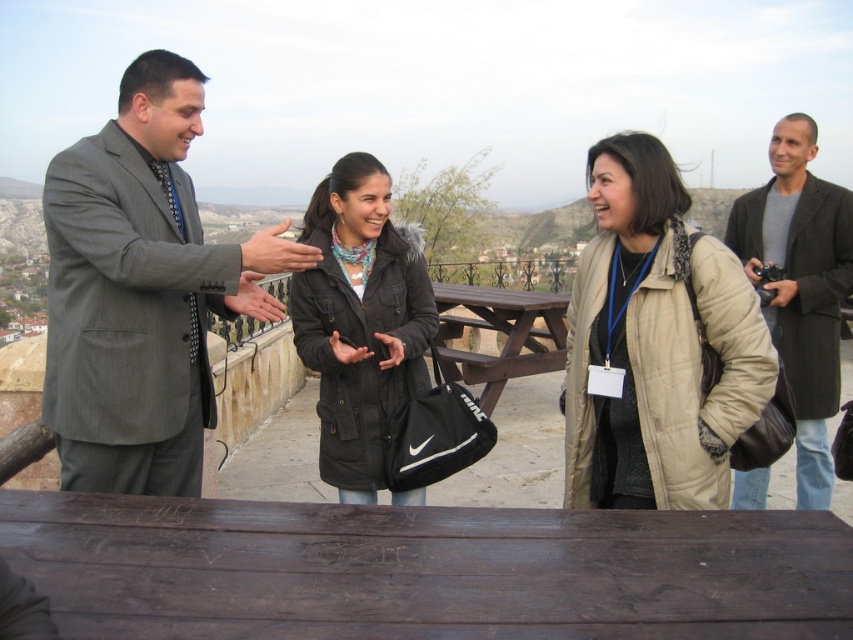
Question: Can you confirm if gray suit at left is thinner than beige quilted jacket at center?

Choices:
 (A) no
 (B) yes

Answer: (A)

Question: Is dark gray coat at right closer to the viewer compared to brown wooden picnic table at center?

Choices:
 (A) yes
 (B) no

Answer: (A)

Question: Which point is farther to the camera?

Choices:
 (A) (445, 308)
 (B) (799, 496)
 (C) (93, 273)
 (D) (630, 198)

Answer: (A)

Question: Among these objects, which one is nearest to the camera?

Choices:
 (A) black matte jacket at center
 (B) dark wood table at lower center
 (C) brown wooden picnic table at center
 (D) dark gray coat at right

Answer: (B)

Question: Which of these objects is positioned closest to the black matte jacket at center?

Choices:
 (A) gray suit at left
 (B) dark wood table at lower center
 (C) brown wooden picnic table at center
 (D) dark gray coat at right

Answer: (A)

Question: Is gray suit at left positioned in front of black matte jacket at center?

Choices:
 (A) yes
 (B) no

Answer: (A)